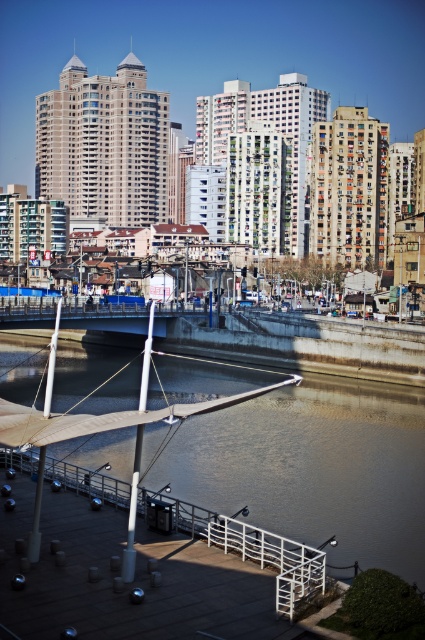
Question: Does brown concrete river at center have a lesser width compared to white wooden dock at lower center?

Choices:
 (A) no
 (B) yes

Answer: (A)

Question: Observing the image, what is the correct spatial positioning of brown concrete river at center in reference to white wooden dock at lower center?

Choices:
 (A) right
 (B) left

Answer: (A)

Question: Which of the following is the farthest from the observer?

Choices:
 (A) brown concrete river at center
 (B) white wooden dock at lower center

Answer: (A)

Question: Which of the following is the farthest from the observer?

Choices:
 (A) white wooden dock at lower center
 (B) brown concrete river at center

Answer: (B)

Question: Is brown concrete river at center below white wooden dock at lower center?

Choices:
 (A) no
 (B) yes

Answer: (A)